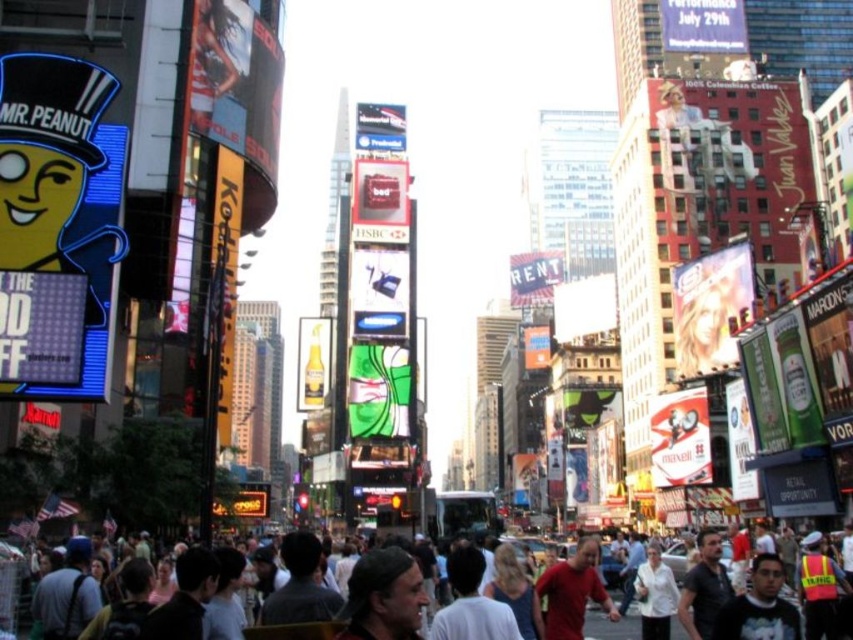
Question: Can you confirm if dark brown leather jacket at center is positioned above white matte shirt at lower right?

Choices:
 (A) no
 (B) yes

Answer: (B)

Question: Is reflective safety vest at lower right positioned at the back of white matte shirt at lower right?

Choices:
 (A) yes
 (B) no

Answer: (B)

Question: Which object is farther from the camera taking this photo?

Choices:
 (A) multicolored casual attire at lower left
 (B) dark brown hair at center
 (C) reflective safety vest at lower right

Answer: (A)

Question: Estimate the real-world distances between objects in this image. Which object is closer to the light brown hair at center?

Choices:
 (A) dark gray backpack at lower left
 (B) dark brown leather jacket at lower center
 (C) dark brown hair at center

Answer: (C)

Question: Which object is closer to the camera taking this photo?

Choices:
 (A) white matte shirt at lower right
 (B) blonde hair at center
 (C) dark gray backpack at lower left

Answer: (C)

Question: Is dark gray backpack at lower left above dark brown leather jacket at lower center?

Choices:
 (A) no
 (B) yes

Answer: (A)